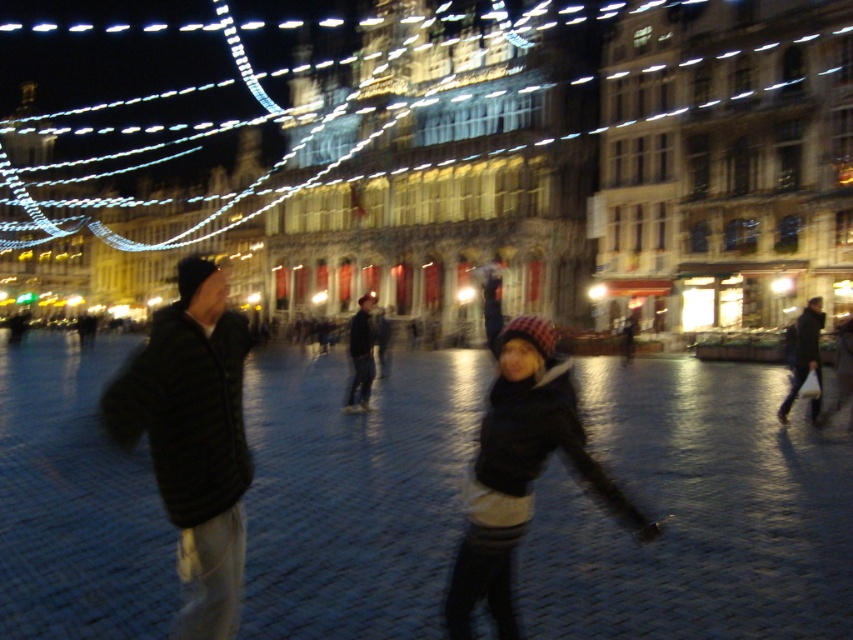
Locate an element on the screen. Image resolution: width=853 pixels, height=640 pixels. plaid woolen hat at center is located at coordinates (520, 472).

Which is more to the right, plaid woolen hat at center or dark gray jacket at right?

dark gray jacket at right is more to the right.

Is point (573, 392) closer to camera compared to point (792, 365)?

That is True.

I want to click on plaid woolen hat at center, so click(520, 472).

Can you confirm if black fuzzy jacket at left is thinner than dark gray jacket at right?

In fact, black fuzzy jacket at left might be wider than dark gray jacket at right.

What do you see at coordinates (193, 440) in the screenshot?
I see `black fuzzy jacket at left` at bounding box center [193, 440].

At what (x,y) coordinates should I click in order to perform the action: click on black fuzzy jacket at left. Please return your answer as a coordinate pair (x, y). This screenshot has height=640, width=853. Looking at the image, I should click on (193, 440).

Which is more to the left, black fuzzy jacket at left or dark blue jeans at center?

black fuzzy jacket at left

Can you confirm if black fuzzy jacket at left is wider than dark blue jeans at center?

Yes, black fuzzy jacket at left is wider than dark blue jeans at center.

Between point (207, 310) and point (355, 355), which one is positioned in front?

Point (207, 310)

Locate an element on the screen. The width and height of the screenshot is (853, 640). black fuzzy jacket at left is located at coordinates (193, 440).